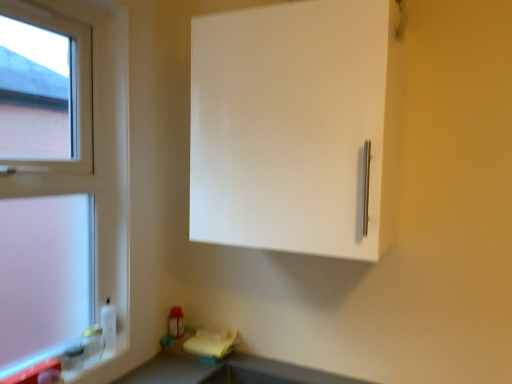
Question: Is white plastic window at left placed right next to smooth gray countertop at lower center?

Choices:
 (A) no
 (B) yes

Answer: (A)

Question: Is white plastic window at left in front of smooth gray countertop at lower center?

Choices:
 (A) no
 (B) yes

Answer: (A)

Question: Is white plastic window at left outside smooth gray countertop at lower center?

Choices:
 (A) yes
 (B) no

Answer: (A)

Question: From a real-world perspective, is white plastic window at left under smooth gray countertop at lower center?

Choices:
 (A) no
 (B) yes

Answer: (A)

Question: Would you say smooth gray countertop at lower center is part of white plastic window at left's contents?

Choices:
 (A) no
 (B) yes

Answer: (A)

Question: Is white plastic window at left to the right of smooth gray countertop at lower center from the viewer's perspective?

Choices:
 (A) no
 (B) yes

Answer: (A)

Question: Could you tell me if smooth gray countertop at lower center is turned towards white plastic window at left?

Choices:
 (A) no
 (B) yes

Answer: (A)

Question: Is smooth gray countertop at lower center with white plastic window at left?

Choices:
 (A) yes
 (B) no

Answer: (B)

Question: Is white plastic window at left inside smooth gray countertop at lower center?

Choices:
 (A) no
 (B) yes

Answer: (A)

Question: Is smooth gray countertop at lower center not within white plastic window at left?

Choices:
 (A) no
 (B) yes

Answer: (B)

Question: From the image's perspective, does smooth gray countertop at lower center appear lower than white plastic window at left?

Choices:
 (A) yes
 (B) no

Answer: (A)

Question: Does smooth gray countertop at lower center have a greater height compared to white plastic window at left?

Choices:
 (A) yes
 (B) no

Answer: (B)

Question: Is smooth gray countertop at lower center to the left of white matte cabinet at upper right from the viewer's perspective?

Choices:
 (A) yes
 (B) no

Answer: (A)